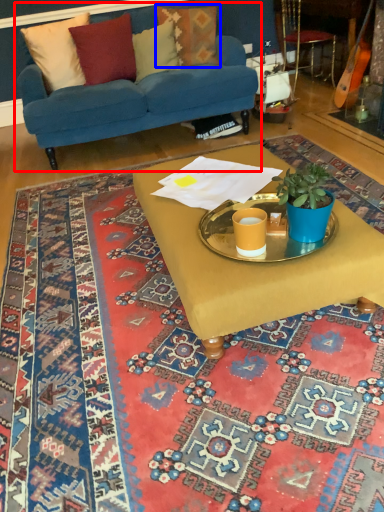
Question: Among these objects, which one is farthest to the camera, studio couch (highlighted by a red box) or pillow (highlighted by a blue box)?

Choices:
 (A) studio couch
 (B) pillow

Answer: (B)